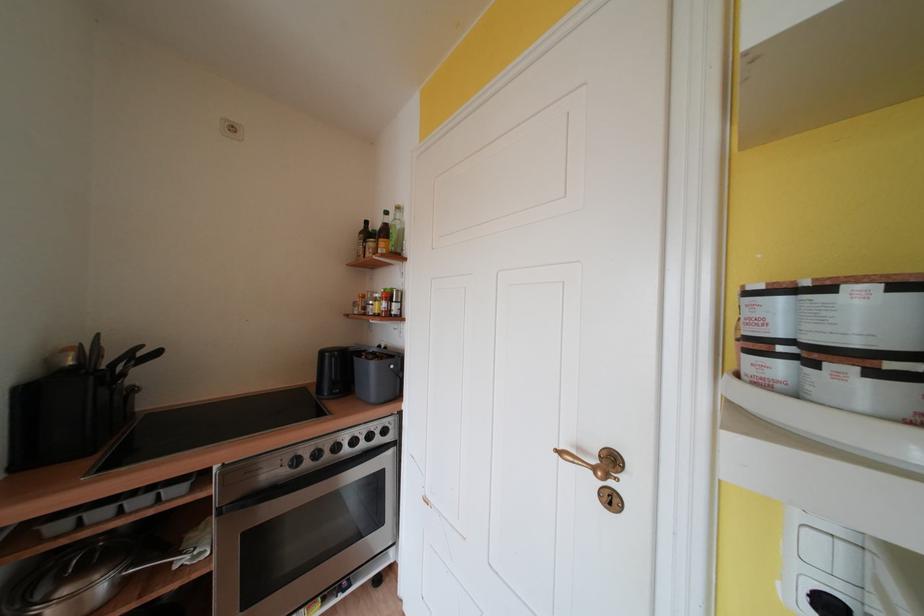
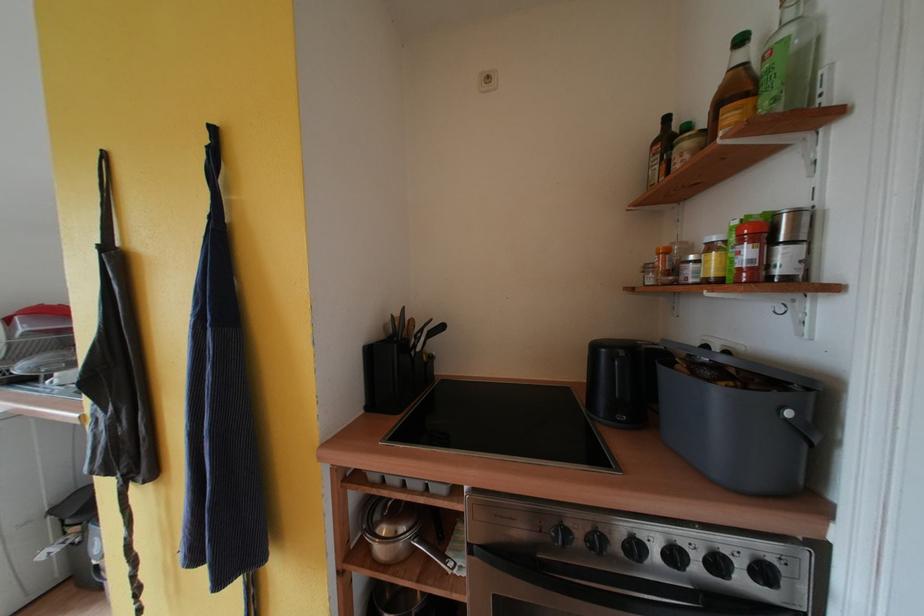
In the second image, find the point that corresponds to the point at 408,225 in the first image.

(817, 28)